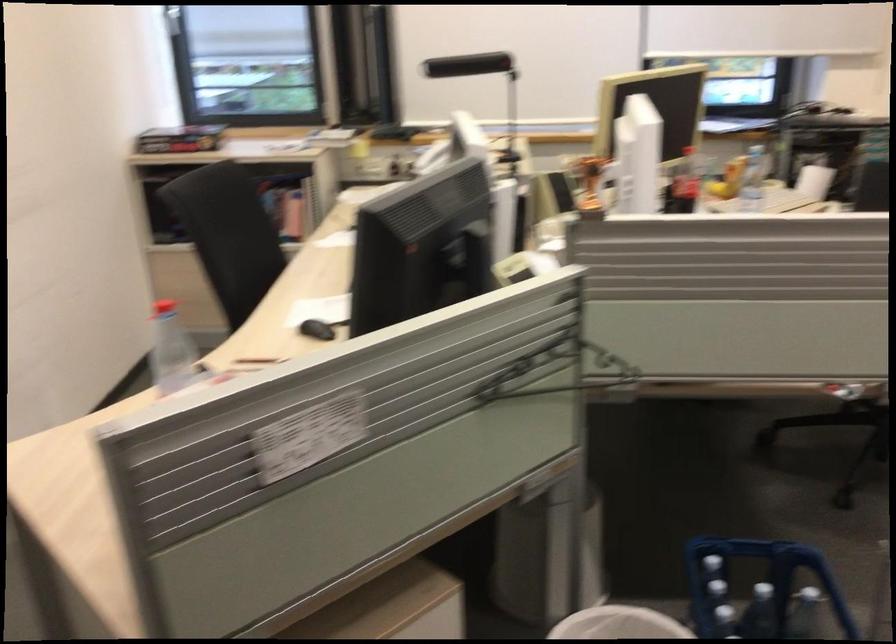
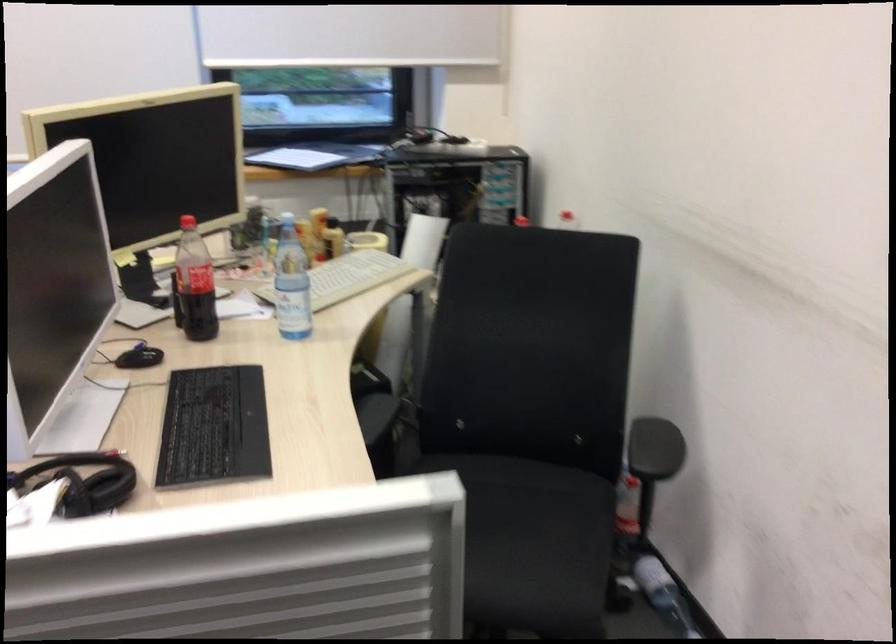
Where in the second image is the point corresponding to pixel 683 185 from the first image?

(194, 283)